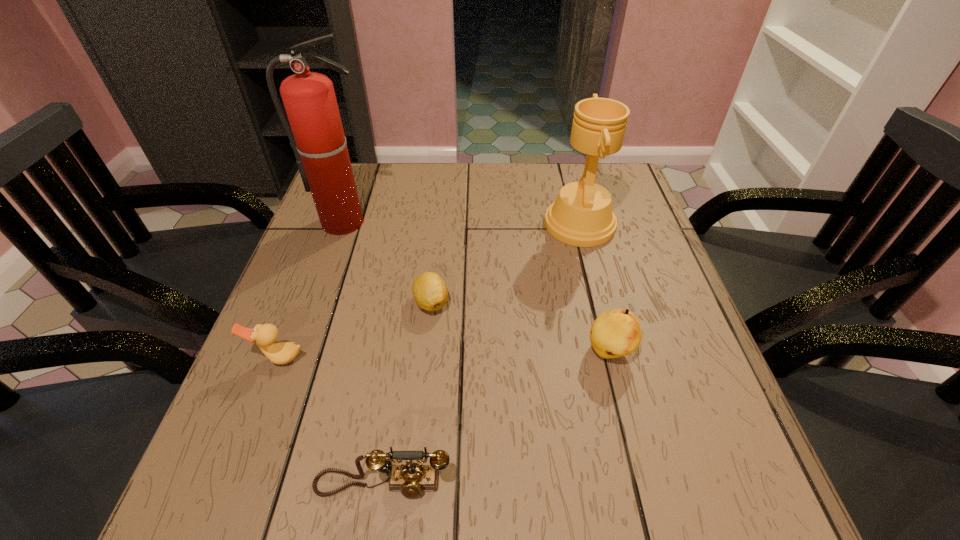
Find the location of a particular element. The width and height of the screenshot is (960, 540). vacant space situated 0.240m on the beak of the duck is located at coordinates (224, 499).

You are a GUI agent. You are given a task and a screenshot of the screen. Output one action in this format:
    pyautogui.click(x=<x>, y=<y>)
    Task: Click on the vacant space situated at the stem end of the fourth nearest object
    
    Given the screenshot: What is the action you would take?
    pyautogui.click(x=425, y=363)

Image resolution: width=960 pixels, height=540 pixels. Identify the location of object present at the far edge. (582, 216).

Identify the location of object present at the near edge. This screenshot has height=540, width=960. (411, 479).

The image size is (960, 540). I want to click on fire extinguisher that is at the left edge, so click(316, 135).

Locate an element on the screen. duck located in the left edge section of the desktop is located at coordinates (265, 335).

Locate an element on the screen. This screenshot has width=960, height=540. award present at the right edge is located at coordinates (582, 216).

Where is `pear that is at the right edge`? This screenshot has height=540, width=960. pear that is at the right edge is located at coordinates (615, 333).

You are a GUI agent. You are given a task and a screenshot of the screen. Output one action in this format:
    pyautogui.click(x=<x>, y=<y>)
    Task: Click on the object situated at the far right corner
    
    Given the screenshot: What is the action you would take?
    pyautogui.click(x=582, y=216)

In the image, there is a desktop. Identify the location of vacant space at the far edge. The width and height of the screenshot is (960, 540). (564, 168).